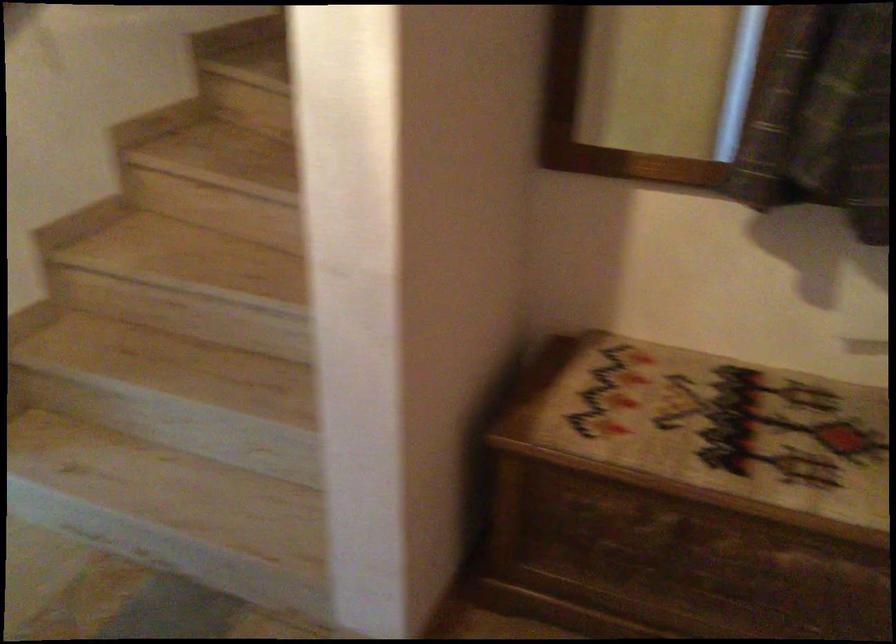
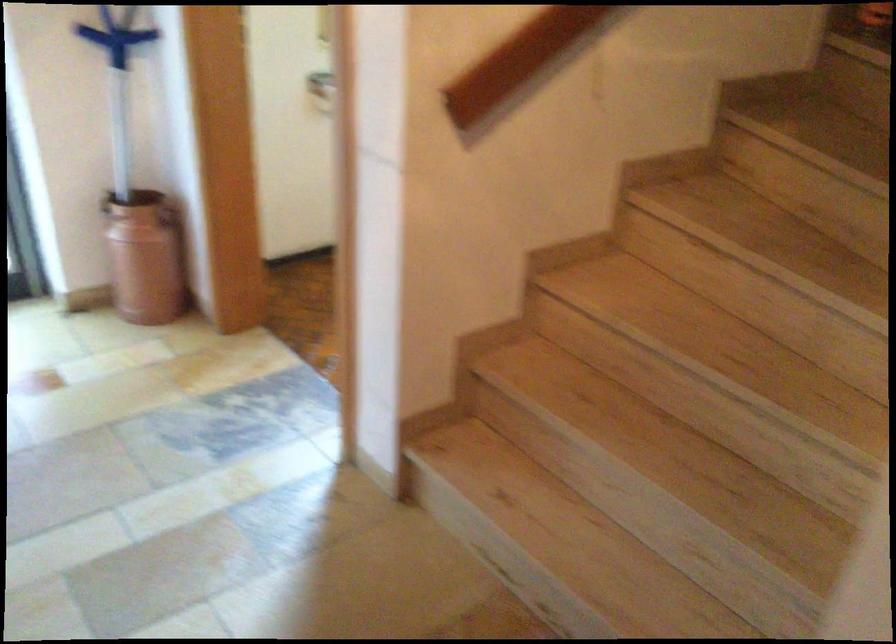
Question: How did the camera likely rotate?

Choices:
 (A) Left
 (B) Right
 (C) Up
 (D) Down

Answer: (A)